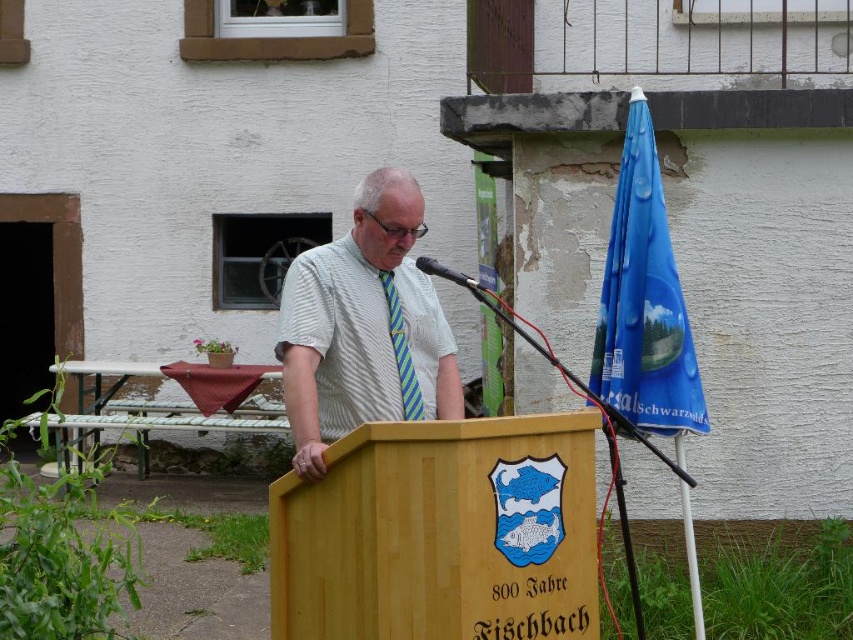
Question: Does white striped shirt at center appear under green striped tie at center?

Choices:
 (A) no
 (B) yes

Answer: (B)

Question: Considering the relative positions of white striped shirt at center and green striped tie at center in the image provided, where is white striped shirt at center located with respect to green striped tie at center?

Choices:
 (A) right
 (B) left

Answer: (B)

Question: Can you confirm if white striped shirt at center is positioned above green striped tie at center?

Choices:
 (A) no
 (B) yes

Answer: (A)

Question: Which object appears closest to the camera in this image?

Choices:
 (A) green striped tie at center
 (B) white striped shirt at center

Answer: (B)